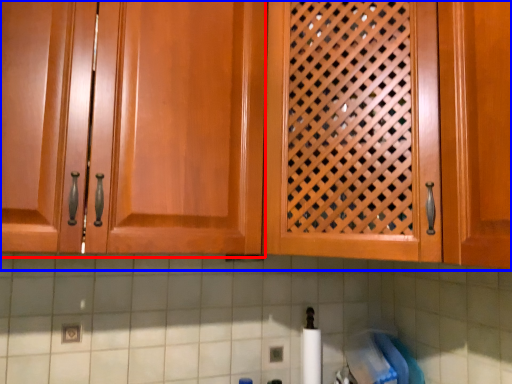
Question: Which object appears farthest to the camera in this image, cabinetry (highlighted by a red box) or cabinetry (highlighted by a blue box)?

Choices:
 (A) cabinetry
 (B) cabinetry

Answer: (B)